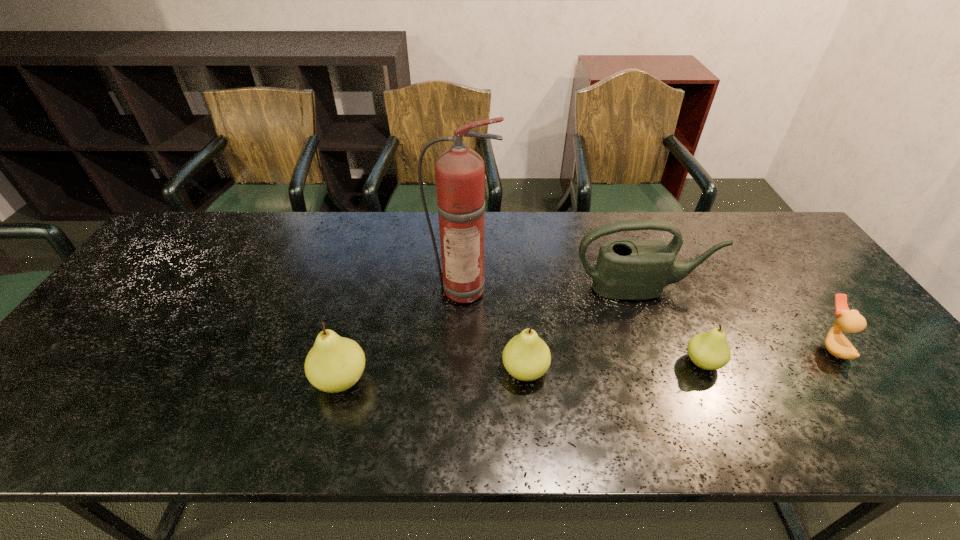
You are a GUI agent. You are given a task and a screenshot of the screen. Output one action in this format:
    pyautogui.click(x=<x>, y=<y>)
    Task: Click on the leftmost object
    The height and width of the screenshot is (540, 960).
    Given the screenshot: What is the action you would take?
    pyautogui.click(x=334, y=364)

You are a GUI agent. You are given a task and a screenshot of the screen. Output one action in this format:
    pyautogui.click(x=<x>, y=<y>)
    Task: Click on the fourth tallest object
    
    Given the screenshot: What is the action you would take?
    pyautogui.click(x=526, y=357)

This screenshot has height=540, width=960. Find the location of `the second pear from left to right`. the second pear from left to right is located at coordinates (526, 357).

You are a GUI agent. You are given a task and a screenshot of the screen. Output one action in this format:
    pyautogui.click(x=<x>, y=<y>)
    Task: Click on the rightmost pear
    
    Given the screenshot: What is the action you would take?
    pyautogui.click(x=709, y=350)

At what (x,y) coordinates should I click in order to perform the action: click on the second tallest object. Please return your answer as a coordinate pair (x, y). The image size is (960, 540). Looking at the image, I should click on (628, 269).

This screenshot has width=960, height=540. What are the coordinates of `the fifth object from right to left` in the screenshot? It's located at (460, 172).

Where is `fire extinguisher`? fire extinguisher is located at coordinates (460, 172).

The image size is (960, 540). I want to click on duck, so click(850, 321).

This screenshot has width=960, height=540. Identify the location of vacant position located on the left of the leftmost object. (236, 380).

Locate an element on the screen. The height and width of the screenshot is (540, 960). vacant space situated 0.360m on the back of the second shortest pear is located at coordinates (515, 257).